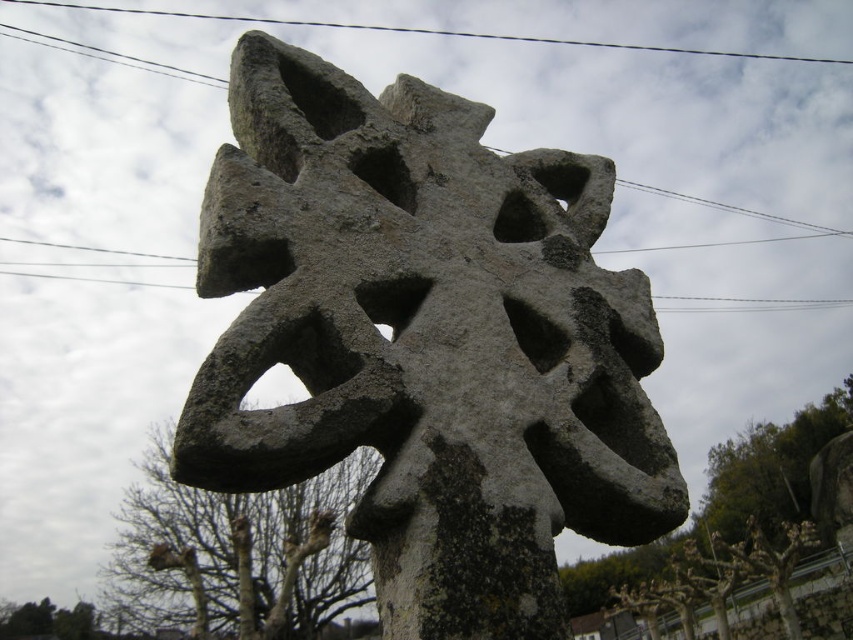
You are a photographer aiming to capture the gray stone cross at center without any obstructions. Given the position of the black wire at upper center, can you adjust your angle to avoid the wire appearing in the shot?

The gray stone cross at center is below the black wire at upper center, so by angling the camera slightly downward, you can position the cross in the frame while keeping the wire out of view.

You are a photographer planning to capture the gray stone cross at center and the black wire at upper center in a single shot. Based on their sizes in the image, which object would you need to frame more carefully to ensure it doesn t get lost in the composition?

The gray stone cross at center is smaller than the black wire at upper center, so you would need to frame the gray stone cross at center more carefully to ensure it doesn t get lost in the composition.